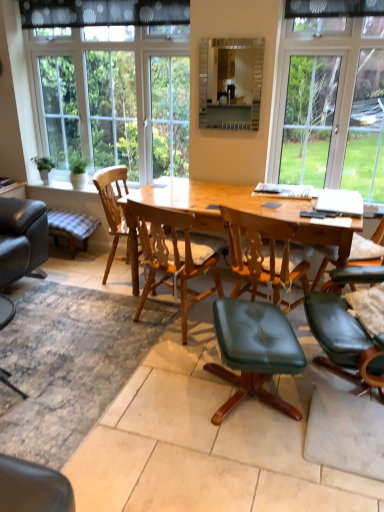
I want to click on vacant space situated above matte glass mirror at upper center (from a real-world perspective), so click(x=225, y=33).